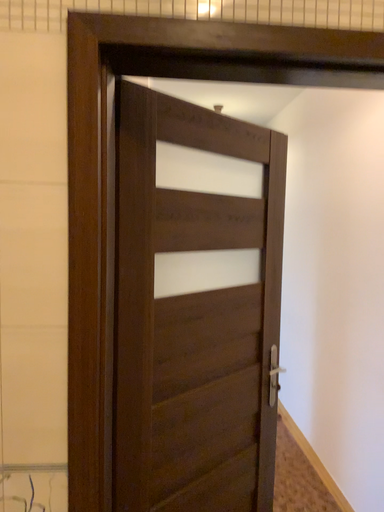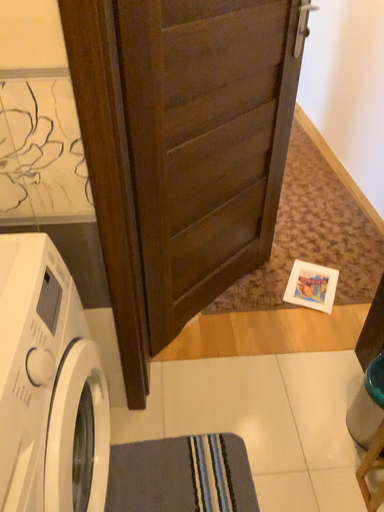
Question: How did the camera likely rotate when shooting the video?

Choices:
 (A) rotated upward
 (B) rotated downward

Answer: (B)